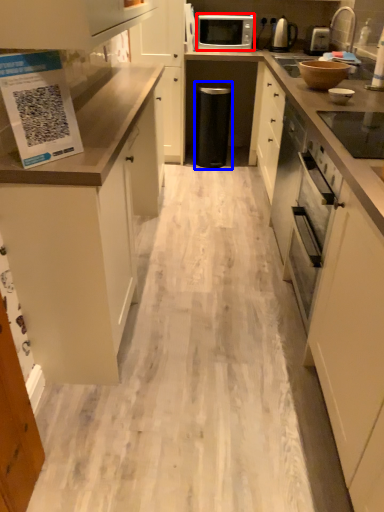
Question: Which object appears closest to the camera in this image, microwave oven (highlighted by a red box) or appliance (highlighted by a blue box)?

Choices:
 (A) microwave oven
 (B) appliance

Answer: (A)